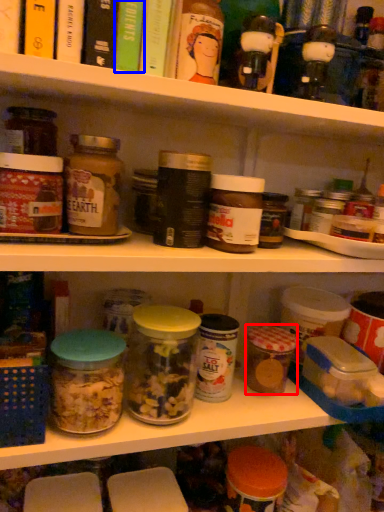
Question: Which object appears closest to the camera in this image, cereal (highlighted by a red box) or book (highlighted by a blue box)?

Choices:
 (A) cereal
 (B) book

Answer: (B)